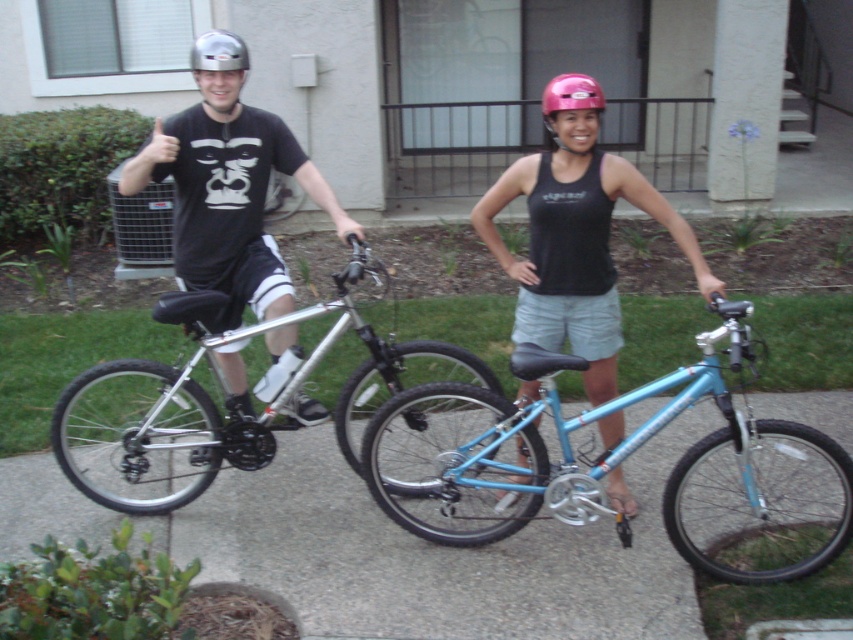
Is point (479, 384) farther from camera compared to point (611, 198)?

Yes, point (479, 384) is behind point (611, 198).

At what (x,y) coordinates should I click in order to perform the action: click on silver metallic bicycle at center. Please return your answer as a coordinate pair (x, y). The width and height of the screenshot is (853, 640). Looking at the image, I should click on (215, 404).

Which is below, silver metallic bicycle at center or metallic silver helmet at upper left?

silver metallic bicycle at center

Is point (123, 413) less distant than point (212, 29)?

Yes, it is.

Does point (177, 432) lie in front of point (241, 67)?

No, (177, 432) is behind (241, 67).

Where is `silver metallic bicycle at center`? The height and width of the screenshot is (640, 853). silver metallic bicycle at center is located at coordinates (215, 404).

Can you confirm if gray asphalt pavement at center is smaller than pink matte helmet at center?

No.

Between point (270, 544) and point (595, 108), which one is positioned behind?

The point (270, 544) is behind.

Who is more distant from viewer, (680,438) or (582,97)?

The point (680,438) is more distant.

You are a GUI agent. You are given a task and a screenshot of the screen. Output one action in this format:
    pyautogui.click(x=<x>, y=<y>)
    Task: Click on the gray asphalt pavement at center
    The image size is (853, 640).
    Given the screenshot: What is the action you would take?
    pyautogui.click(x=434, y=556)